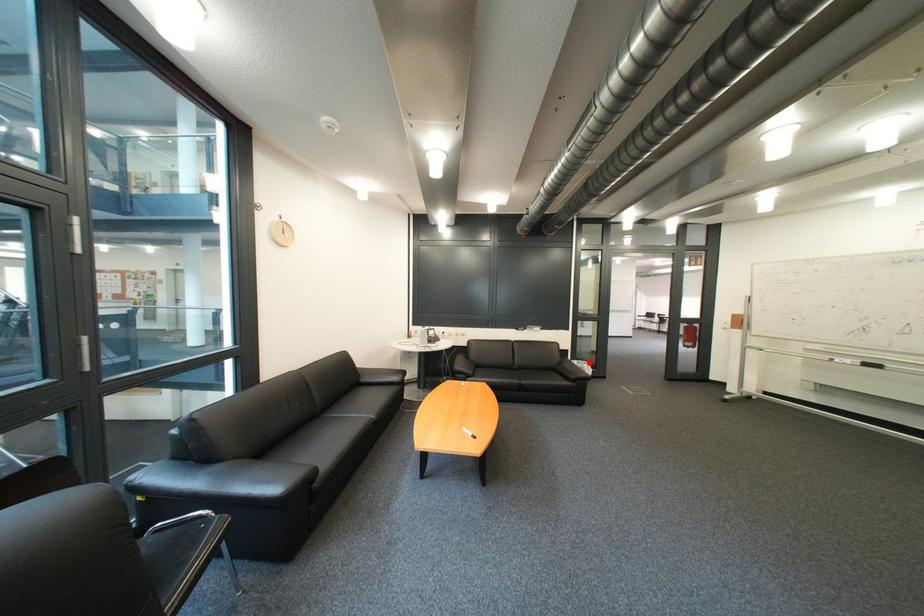
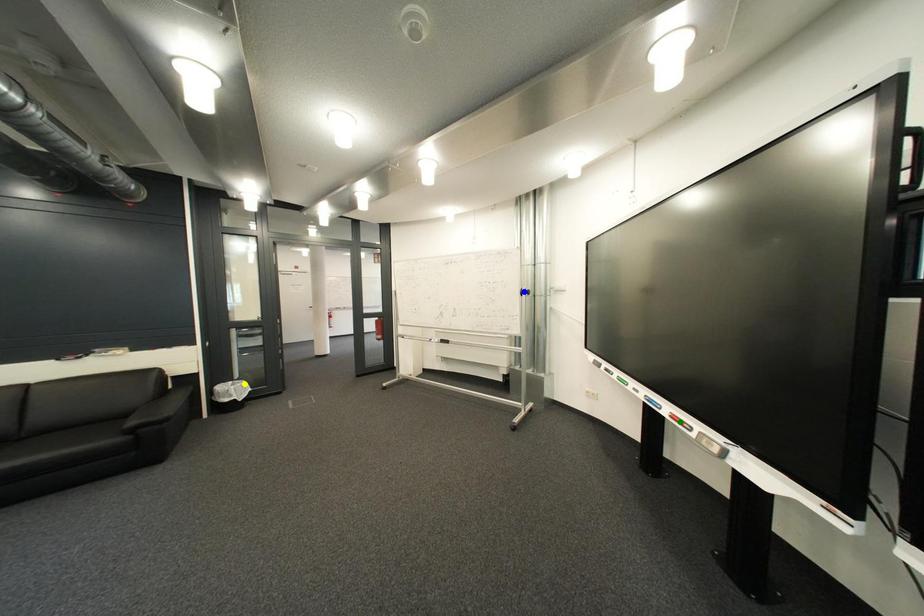
Question: I am providing you with two images of the same scene from different viewpoints. A red point is marked on the first image. You are given multiple points on the second image. Can you choose the point in image 2 that corresponds to the point in image 1?

Choices:
 (A) green point
 (B) blue point
 (C) yellow point

Answer: (C)